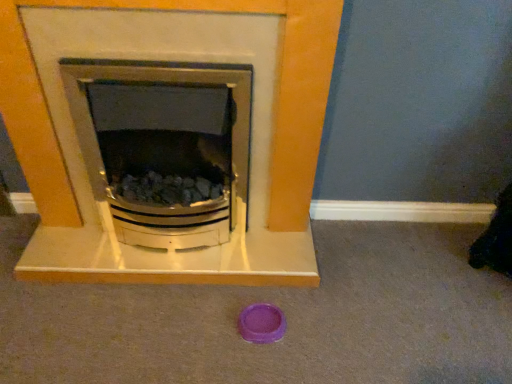
The width and height of the screenshot is (512, 384). Identify the location of matte white fireplace at center. (178, 81).

Describe the element at coordinates (178, 81) in the screenshot. The width and height of the screenshot is (512, 384). I see `matte white fireplace at center` at that location.

The image size is (512, 384). In order to click on matte white fireplace at center in this screenshot , I will do `click(178, 81)`.